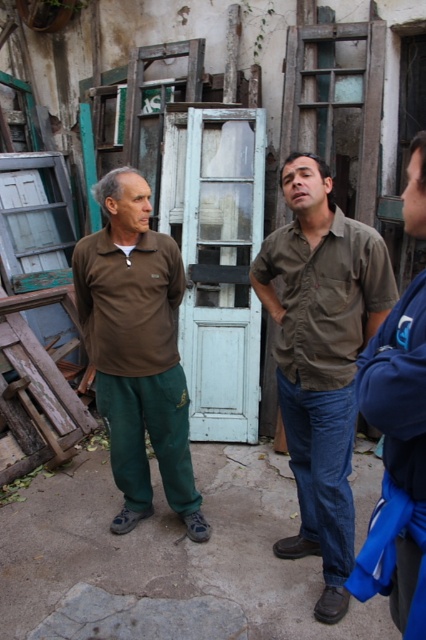
What is the width comparison between the white wooden door at center and the blue fleece jacket at right?

The white wooden door at center is wider than the blue fleece jacket at right.